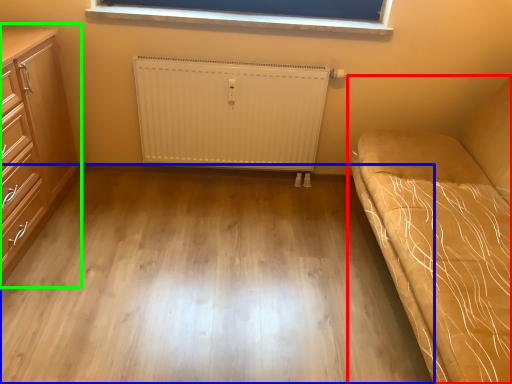
Question: Which object is the farthest from studio couch (highlighted by a red box)? Choose among these: plain (highlighted by a blue box) or chest of drawers (highlighted by a green box).

Choices:
 (A) plain
 (B) chest of drawers

Answer: (B)